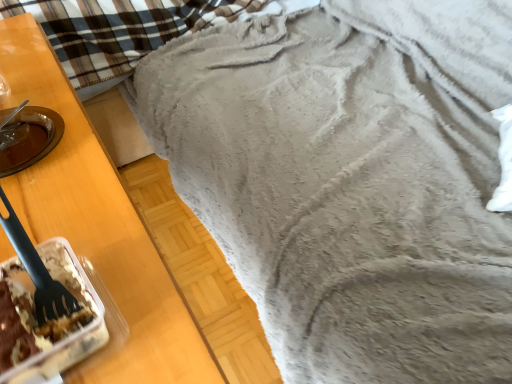
The width and height of the screenshot is (512, 384). What are the coordinates of `unoccupied space behind black plastic fork at left` in the screenshot? It's located at (74, 201).